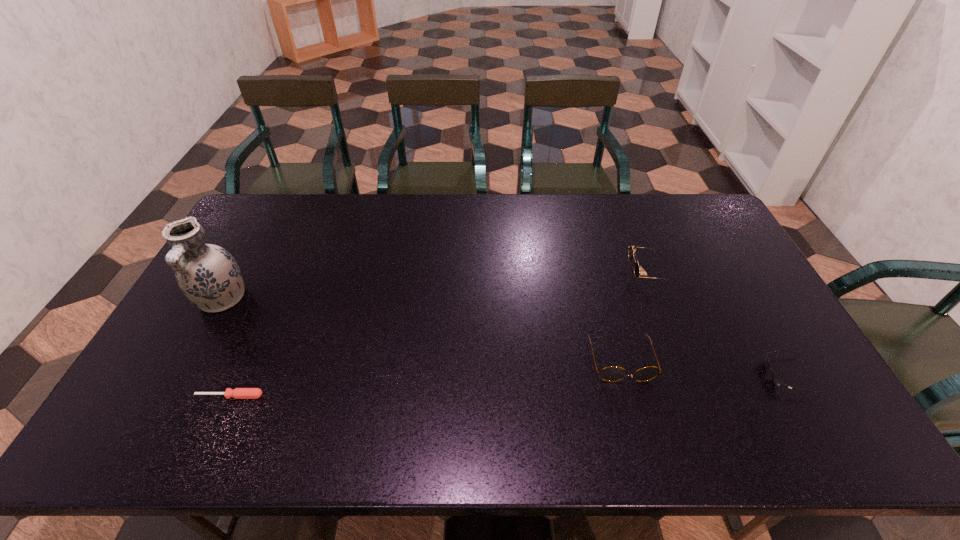
The image size is (960, 540). Find the location of `vacant area that lies between the farthest sunglasses and the vase`. vacant area that lies between the farthest sunglasses and the vase is located at coordinates (436, 286).

Locate an element on the screen. The height and width of the screenshot is (540, 960). blank region between the third object from left to right and the screwdriver is located at coordinates [425, 378].

The width and height of the screenshot is (960, 540). Find the location of `unoccupied area between the second shortest object and the second object from right to left`. unoccupied area between the second shortest object and the second object from right to left is located at coordinates (719, 323).

Locate an element on the screen. The height and width of the screenshot is (540, 960). empty location between the shortest object and the second sunglasses from right to left is located at coordinates (440, 334).

Where is `empty location between the rightmost object and the tallest object`? This screenshot has height=540, width=960. empty location between the rightmost object and the tallest object is located at coordinates (505, 337).

Locate an element on the screen. The image size is (960, 540). the second closest object to the third object from right to left is located at coordinates (776, 380).

Image resolution: width=960 pixels, height=540 pixels. I want to click on object that stands as the third closest to the third object from left to right, so click(238, 393).

I want to click on the closest sunglasses to the second object from right to left, so click(x=612, y=373).

Where is `the closest sunglasses to the second sunglasses from right to left`? This screenshot has height=540, width=960. the closest sunglasses to the second sunglasses from right to left is located at coordinates (612, 373).

Where is `free region that satisfies the following two spatial constraints: 1. on the front lenses of the fourth object from left to right; 2. on the lenses of the third object from left to right`? The width and height of the screenshot is (960, 540). free region that satisfies the following two spatial constraints: 1. on the front lenses of the fourth object from left to right; 2. on the lenses of the third object from left to right is located at coordinates (684, 360).